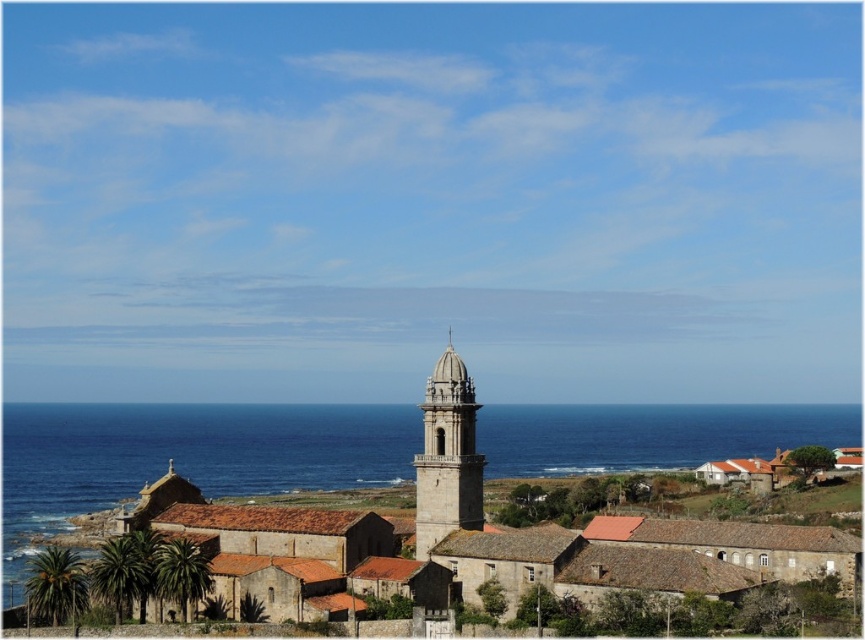
Question: Which object is closer to the camera taking this photo?

Choices:
 (A) stone steeple at center
 (B) blue water at center

Answer: (A)

Question: Is blue water at center wider than stone steeple at center?

Choices:
 (A) no
 (B) yes

Answer: (B)

Question: Is blue water at center above stone steeple at center?

Choices:
 (A) yes
 (B) no

Answer: (B)

Question: Does blue water at center appear under stone steeple at center?

Choices:
 (A) no
 (B) yes

Answer: (B)